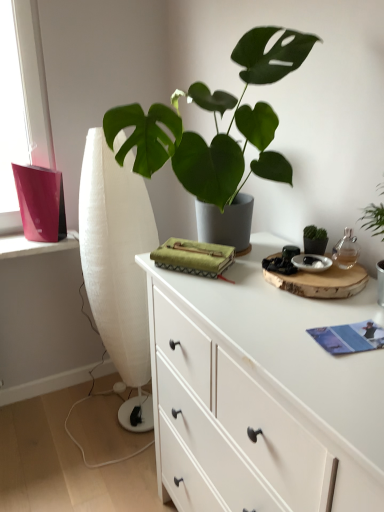
Locate an element on the screen. This screenshot has width=384, height=512. green matte plant at center is located at coordinates (216, 124).

This screenshot has height=512, width=384. I want to click on white matte chest of drawers at center, so click(261, 394).

Locate an element on the screen. green matte plant at center is located at coordinates (216, 124).

Does blue paper book at lower right have a larger size compared to white matte chest of drawers at center?

No, blue paper book at lower right is not bigger than white matte chest of drawers at center.

From the image's perspective, is blue paper book at lower right located beneath white matte chest of drawers at center?

Incorrect, from the image's perspective, blue paper book at lower right is higher than white matte chest of drawers at center.

From their relative heights in the image, would you say blue paper book at lower right is taller or shorter than white matte chest of drawers at center?

Considering their sizes, blue paper book at lower right has less height than white matte chest of drawers at center.

Consider the image. Is green matte plant at center placed right next to white matte chest of drawers at center?

No, green matte plant at center is not beside white matte chest of drawers at center.

Is green matte plant at center shorter than white matte chest of drawers at center?

Indeed, green matte plant at center has a lesser height compared to white matte chest of drawers at center.

Identify the location of houseplant in front of the white matte chest of drawers at center. The width and height of the screenshot is (384, 512). (216, 124).

Which is behind, green matte plant at center or white matte chest of drawers at center?

white matte chest of drawers at center is more distant.

Which point is more forward, (120, 204) or (361, 336)?

The point (361, 336) is more forward.

Looking at the image, does white fabric curtain at left seem bigger or smaller compared to blue paper book at lower right?

Clearly, white fabric curtain at left is larger in size than blue paper book at lower right.

Consider the image. Is white fabric curtain at left far away from blue paper book at lower right?

white fabric curtain at left is positioned a significant distance from blue paper book at lower right.

From the image's perspective, between white fabric curtain at left and blue paper book at lower right, who is located below?

blue paper book at lower right, from the image's perspective.

Can we say white matte chest of drawers at center lies outside green matte plant at center?

Yes, white matte chest of drawers at center is outside of green matte plant at center.

Based on the photo, from a real-world perspective, is white matte chest of drawers at center over green matte plant at center?

Actually, white matte chest of drawers at center is physically below green matte plant at center in the real world.

Which is more to the left, white matte chest of drawers at center or green matte plant at center?

green matte plant at center is more to the left.

Are white matte chest of drawers at center and green matte plant at center located far from each other?

No.

Is blue paper book at lower right not near green matte plant at center?

No, there isn't a large distance between blue paper book at lower right and green matte plant at center.

Does blue paper book at lower right turn towards green matte plant at center?

No.

From the picture: Considering the positions of objects blue paper book at lower right and green matte plant at center in the image provided, who is more to the right, blue paper book at lower right or green matte plant at center?

blue paper book at lower right is more to the right.

Does blue paper book at lower right come behind green matte plant at center?

Yes, blue paper book at lower right is further from the viewer.

Is white matte chest of drawers at center positioned beyond the bounds of blue paper book at lower right?

Absolutely, white matte chest of drawers at center is external to blue paper book at lower right.

Between white matte chest of drawers at center and blue paper book at lower right, which one appears on the right side from the viewer's perspective?

blue paper book at lower right is more to the right.

Would you consider white matte chest of drawers at center to be distant from blue paper book at lower right?

white matte chest of drawers at center is actually quite close to blue paper book at lower right.

Consider the image. From a real-world perspective, is white matte chest of drawers at center located beneath blue paper book at lower right?

Yes, from a real-world perspective, white matte chest of drawers at center is under blue paper book at lower right.

How much distance is there between white matte chest of drawers at center and white fabric curtain at left?

white matte chest of drawers at center and white fabric curtain at left are 24.08 inches apart.

What are the coordinates of `the chest of drawers that appears in front of the white fabric curtain at left` in the screenshot? It's located at (261, 394).

Is white matte chest of drawers at center far away from white fabric curtain at left?

No, white matte chest of drawers at center is not far away from white fabric curtain at left.

Is white matte chest of drawers at center oriented away from white fabric curtain at left?

That's not correct — white matte chest of drawers at center is not looking away from white fabric curtain at left.

Locate an element on the screen. The width and height of the screenshot is (384, 512). chest of drawers that is on the left side of blue paper book at lower right is located at coordinates (261, 394).

In order to click on chest of drawers on the right side of green matte plant at center in this screenshot , I will do `click(261, 394)`.

Estimate the real-world distances between objects in this image. Which object is closer to white fabric curtain at left, white matte chest of drawers at center or green matte plant at center?

The object closer to white fabric curtain at left is white matte chest of drawers at center.

Based on the photo, looking at the image, which one is located closer to green matte plant at center, white matte chest of drawers at center or white fabric curtain at left?

white matte chest of drawers at center.

Looking at the image, which one is located further to blue paper book at lower right, green matte plant at center or white fabric curtain at left?

Based on the image, white fabric curtain at left appears to be further to blue paper book at lower right.

Estimate the real-world distances between objects in this image. Which object is closer to green matte plant at center, blue paper book at lower right or white matte chest of drawers at center?

The object closer to green matte plant at center is white matte chest of drawers at center.

Estimate the real-world distances between objects in this image. Which object is closer to white fabric curtain at left, white matte chest of drawers at center or blue paper book at lower right?

white matte chest of drawers at center.

From the image, which object appears to be nearer to blue paper book at lower right, white fabric curtain at left or white matte chest of drawers at center?

Based on the image, white matte chest of drawers at center appears to be nearer to blue paper book at lower right.

From the image, which object appears to be nearer to white matte chest of drawers at center, blue paper book at lower right or green matte plant at center?

blue paper book at lower right lies closer to white matte chest of drawers at center than the other object.

When comparing their distances from white matte chest of drawers at center, does white fabric curtain at left or blue paper book at lower right seem further?

white fabric curtain at left is further to white matte chest of drawers at center.

Where is `book between white matte chest of drawers at center and white fabric curtain at left along the z-axis`? This screenshot has height=512, width=384. book between white matte chest of drawers at center and white fabric curtain at left along the z-axis is located at coordinates (349, 337).

Identify the location of book between green matte plant at center and white matte chest of drawers at center in the up-down direction. coord(349,337).

At what (x,y) coordinates should I click in order to perform the action: click on book positioned between green matte plant at center and white fabric curtain at left from near to far. Please return your answer as a coordinate pair (x, y). Looking at the image, I should click on (349, 337).

Where is `curtain between green matte plant at center and white matte chest of drawers at center vertically`? curtain between green matte plant at center and white matte chest of drawers at center vertically is located at coordinates (116, 255).